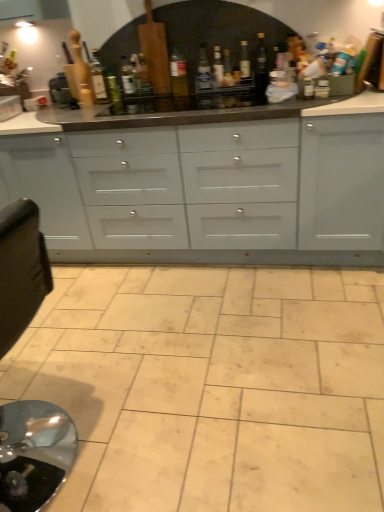
Question: Does white glossy cabinets at center lie in front of translucent glass bottle at center, which ranks as the 8th bottle in left-to-right order?

Choices:
 (A) yes
 (B) no

Answer: (A)

Question: From the image's perspective, is white glossy cabinets at center on translucent glass bottle at center, the 3th bottle when ordered from right to left?

Choices:
 (A) no
 (B) yes

Answer: (A)

Question: From the image's perspective, is white glossy cabinets at center beneath translucent glass bottle at center, which ranks as the 8th bottle in left-to-right order?

Choices:
 (A) no
 (B) yes

Answer: (B)

Question: Is white glossy cabinets at center further to camera compared to translucent glass bottle at center, which ranks as the 8th bottle in left-to-right order?

Choices:
 (A) yes
 (B) no

Answer: (B)

Question: Is white glossy cabinets at center directly adjacent to translucent glass bottle at center, the 3th bottle when ordered from right to left?

Choices:
 (A) yes
 (B) no

Answer: (B)

Question: In the image, is black leather swivel chair at left on the left side or the right side of black glass bottle at center, the 10th bottle when ordered from left to right?

Choices:
 (A) left
 (B) right

Answer: (A)

Question: Is black leather swivel chair at left in front of or behind black glass bottle at center, which appears as the 1th bottle when viewed from the right, in the image?

Choices:
 (A) behind
 (B) front

Answer: (B)

Question: Is black leather swivel chair at left wider or thinner than black glass bottle at center, which appears as the 1th bottle when viewed from the right?

Choices:
 (A) wide
 (B) thin

Answer: (A)

Question: Considering the positions of black leather swivel chair at left and black glass bottle at center, which appears as the 1th bottle when viewed from the right, in the image, is black leather swivel chair at left bigger or smaller than black glass bottle at center, which appears as the 1th bottle when viewed from the right,?

Choices:
 (A) small
 (B) big

Answer: (B)

Question: Is white glossy cabinets at center inside the boundaries of wooden rolling pin at upper left, which is counted as the 1th bottle, starting from the left, or outside?

Choices:
 (A) inside
 (B) outside

Answer: (B)

Question: Considering the positions of white glossy cabinets at center and wooden rolling pin at upper left, which is the tenth bottle from right to left, in the image, is white glossy cabinets at center wider or thinner than wooden rolling pin at upper left, which is the tenth bottle from right to left,?

Choices:
 (A) thin
 (B) wide

Answer: (B)

Question: Considering their positions, is white glossy cabinets at center located in front of or behind wooden rolling pin at upper left, which is the tenth bottle from right to left?

Choices:
 (A) behind
 (B) front

Answer: (B)

Question: Looking at the image, does white glossy cabinets at center seem bigger or smaller compared to wooden rolling pin at upper left, which is counted as the 1th bottle, starting from the left?

Choices:
 (A) small
 (B) big

Answer: (B)

Question: Choose the correct answer: Is wooden rolling pin at upper left, which is the tenth bottle from right to left, inside white glossy cabinets at center or outside it?

Choices:
 (A) inside
 (B) outside

Answer: (B)

Question: From a real-world perspective, is wooden rolling pin at upper left, which is counted as the 1th bottle, starting from the left, above or below white glossy cabinets at center?

Choices:
 (A) below
 (B) above

Answer: (B)